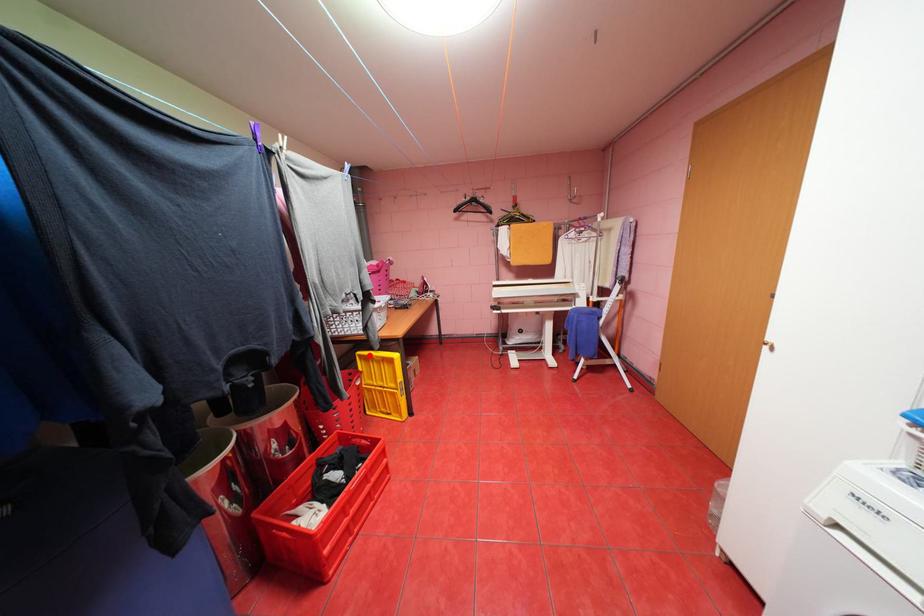
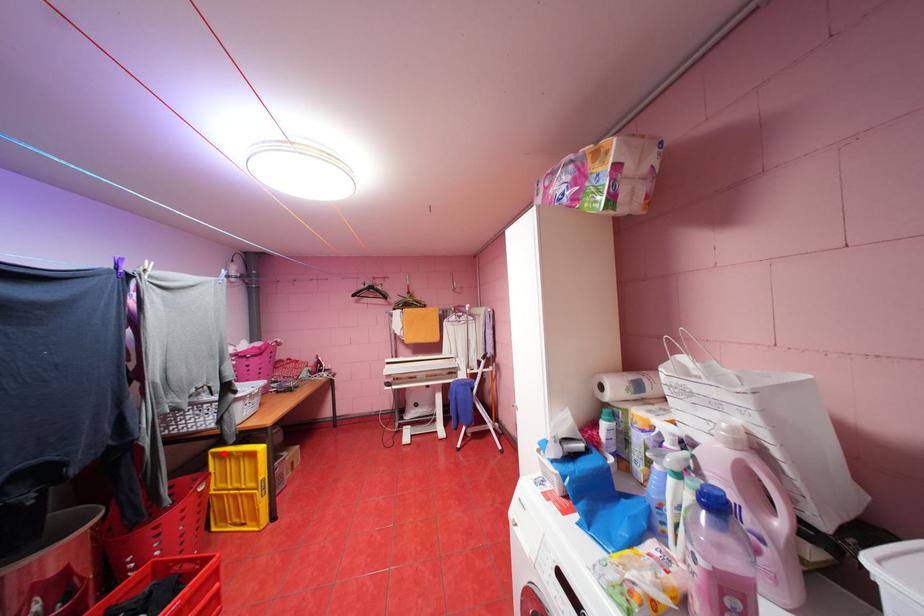
I am providing you with two images of the same scene from different viewpoints. A red point is marked on the first image and another point is marked on the second image. Are the points marked in image1 and image2 representing the same 3D position?

Yes